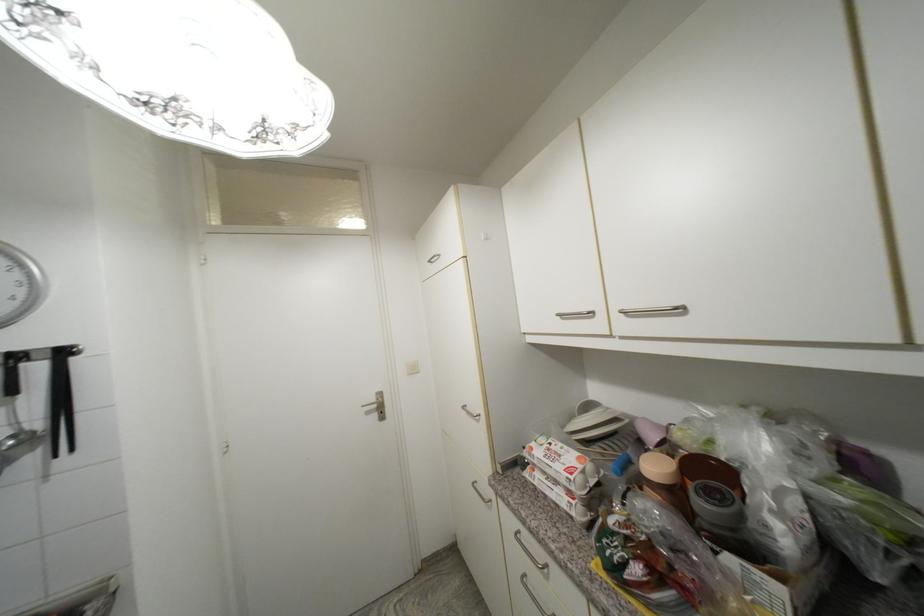
Find the location of a particular element. The image size is (924, 616). metal door handle is located at coordinates (377, 406).